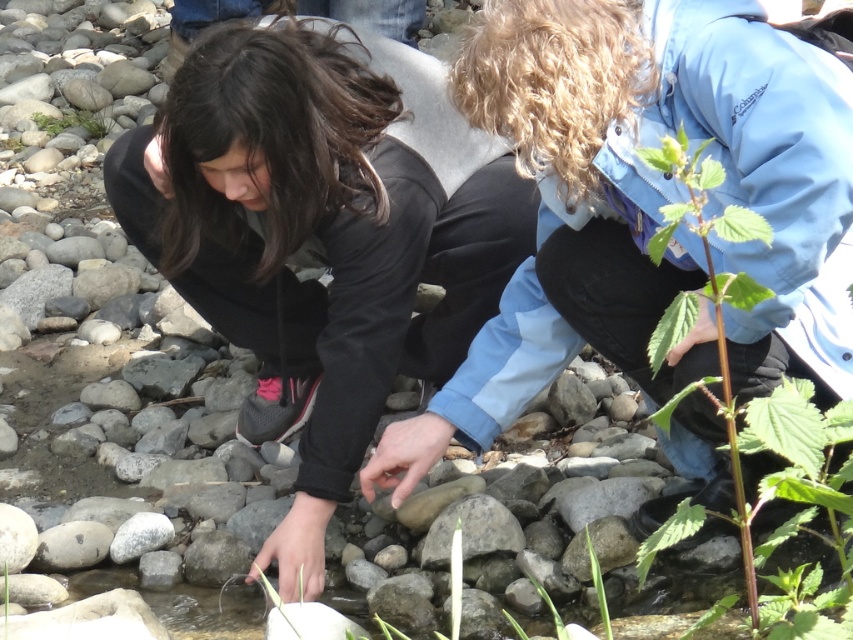
You are a photographer trying to capture both the black matte jacket at center and the green leafy stem at center right in the same frame. Which object should you focus on first to ensure both are in the frame?

The black matte jacket at center is bigger than the green leafy stem at center right, so you should focus on the black matte jacket at center first to ensure both fit in the frame.

You are a hiker who needs to decide which item to use for covering a small wound. Considering the black matte jacket at center and the green leafy plant at upper left, which one is wider and thus more suitable for this purpose?

The black matte jacket at center is wider than the green leafy plant at upper left, making it more suitable for covering a small wound.